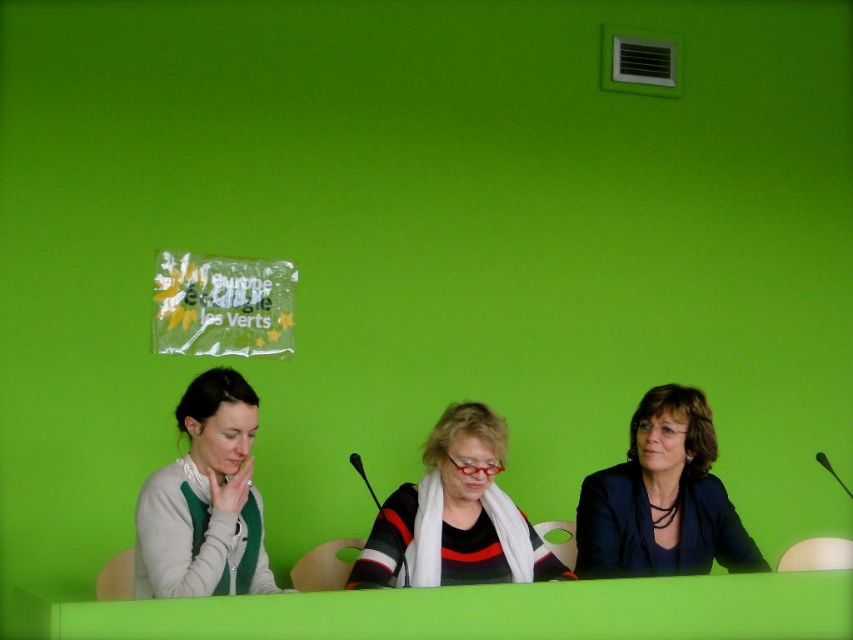
Question: Which of the following is the farthest from the observer?

Choices:
 (A) white matte sweater at left
 (B) striped sweater with scarf at center

Answer: (B)

Question: Among these points, which one is nearest to the camera?

Choices:
 (A) 463,465
 (B) 714,445
 (C) 236,481

Answer: (C)

Question: Is the position of blue fabric jacket at center less distant than that of striped sweater with scarf at center?

Choices:
 (A) no
 (B) yes

Answer: (A)

Question: Is white matte sweater at left wider than striped sweater with scarf at center?

Choices:
 (A) no
 (B) yes

Answer: (A)

Question: Which is nearer to the white matte sweater at left?

Choices:
 (A) striped sweater with scarf at center
 (B) green matte table at center

Answer: (B)

Question: Is blue fabric jacket at center to the right of white matte sweater at left from the viewer's perspective?

Choices:
 (A) no
 (B) yes

Answer: (B)